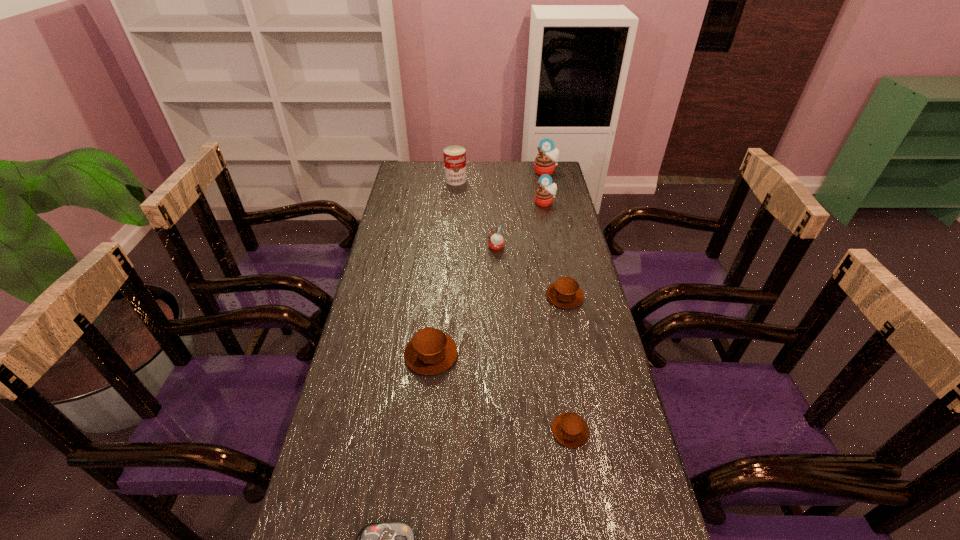
Locate an element on the screen. The width and height of the screenshot is (960, 540). the second shortest muffin is located at coordinates (565, 293).

Locate an element on the screen. the smallest brown muffin is located at coordinates tap(569, 429).

You are a GUI agent. You are given a task and a screenshot of the screen. Output one action in this format:
    pyautogui.click(x=<x>, y=<y>)
    Task: Click on the shortest muffin
    
    Given the screenshot: What is the action you would take?
    pyautogui.click(x=569, y=429)

Locate an element on the screen. Image resolution: width=960 pixels, height=540 pixels. free spot located on the front-facing side of the tallest muffin is located at coordinates (550, 191).

I want to click on free space located on the front label of the can, so click(x=451, y=237).

In order to click on vacant space positioned 0.130m on the front-facing side of the second nearest pink muffin in this screenshot , I will do `click(549, 227)`.

Where is `vacant space positioned on the front-facing side of the fifth nearest object`? Image resolution: width=960 pixels, height=540 pixels. vacant space positioned on the front-facing side of the fifth nearest object is located at coordinates (396, 247).

This screenshot has height=540, width=960. Find the location of `vacant region located 0.170m on the front-facing side of the fifth nearest object`. vacant region located 0.170m on the front-facing side of the fifth nearest object is located at coordinates (441, 247).

Where is `vacant space located 0.270m on the front-facing side of the fifth nearest object`? vacant space located 0.270m on the front-facing side of the fifth nearest object is located at coordinates (413, 247).

Locate an element on the screen. This screenshot has width=960, height=540. free region located 0.210m on the right of the leftmost muffin is located at coordinates (533, 354).